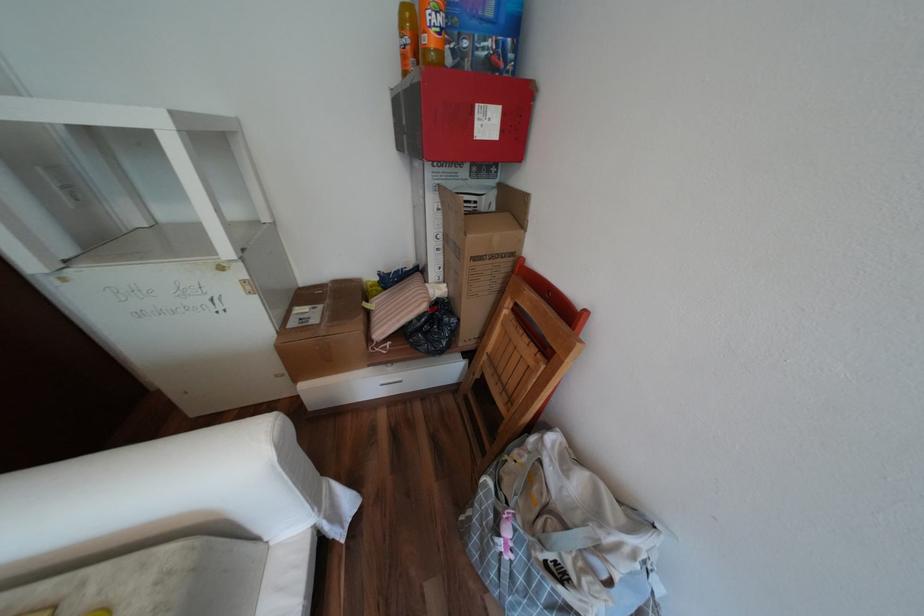
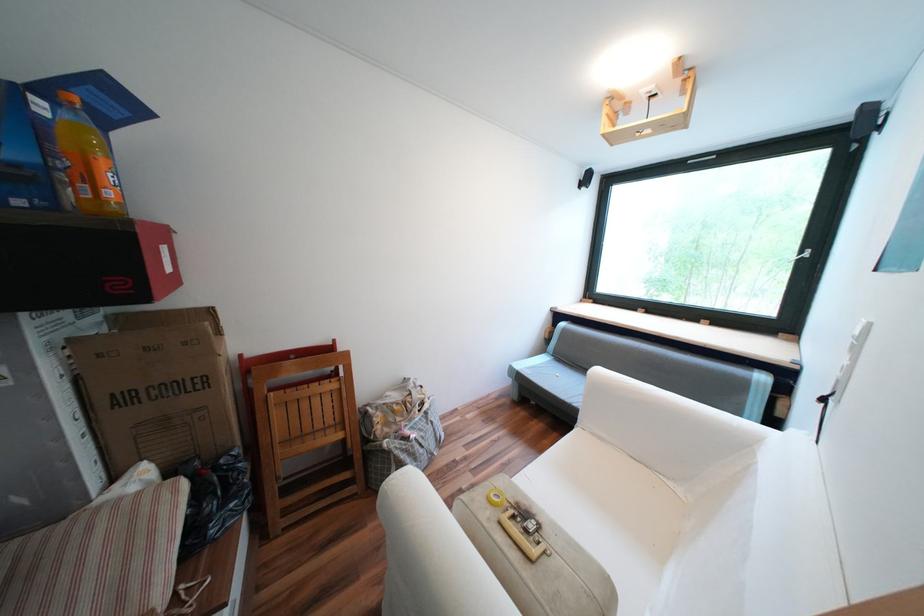
Locate, in the second image, the point that corresponds to point 526,451 in the first image.

(383, 419)